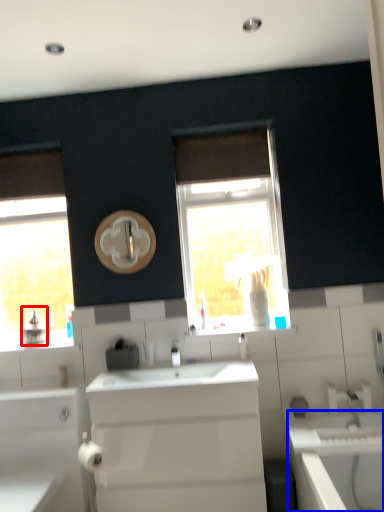
Question: Which object appears farthest to the camera in this image, appliance (highlighted by a red box) or bath (highlighted by a blue box)?

Choices:
 (A) appliance
 (B) bath

Answer: (A)